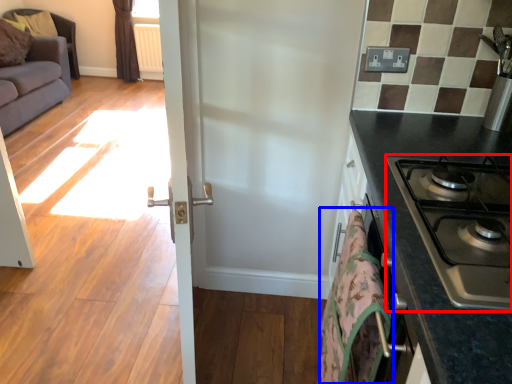
Question: Among these objects, which one is farthest to the camera, gas stove (highlighted by a red box) or blanket (highlighted by a blue box)?

Choices:
 (A) gas stove
 (B) blanket

Answer: (B)